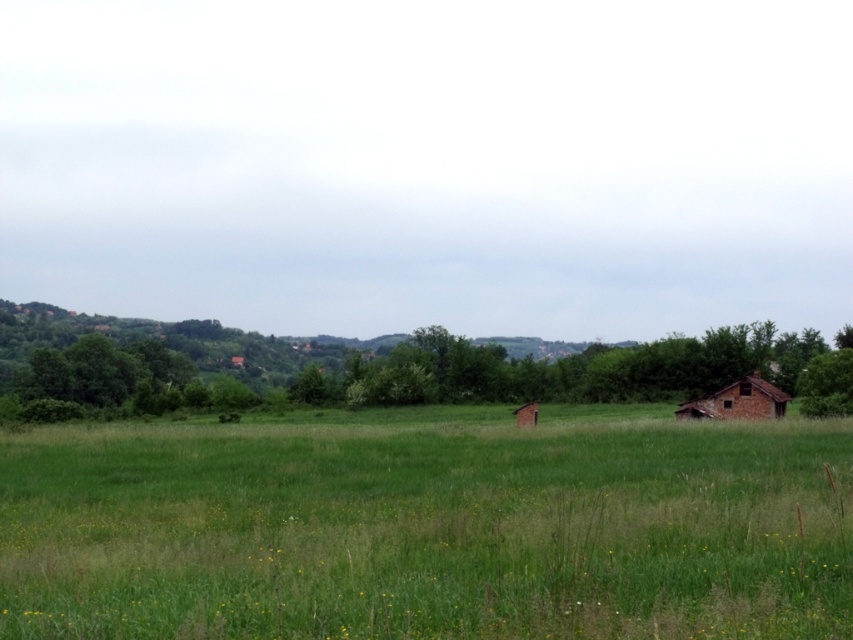
Question: Considering the relative positions of green grassy pasture at center and brown rustic hut at lower right in the image provided, where is green grassy pasture at center located with respect to brown rustic hut at lower right?

Choices:
 (A) below
 (B) above

Answer: (B)

Question: Is green grassy pasture at center bigger than brown rustic hut at lower right?

Choices:
 (A) yes
 (B) no

Answer: (A)

Question: Does green grassy pasture at center have a larger size compared to green leafy tree at center?

Choices:
 (A) yes
 (B) no

Answer: (B)

Question: Which of these objects is positioned closest to the green leafy tree at center?

Choices:
 (A) green grassy pasture at center
 (B) brown rustic hut at lower right

Answer: (B)

Question: Which of these objects is positioned closest to the green grassy pasture at center?

Choices:
 (A) brown rustic hut at lower right
 (B) green leafy tree at center

Answer: (A)

Question: Which object is the farthest from the green leafy tree at center?

Choices:
 (A) brown rustic hut at lower right
 (B) green grassy pasture at center

Answer: (B)